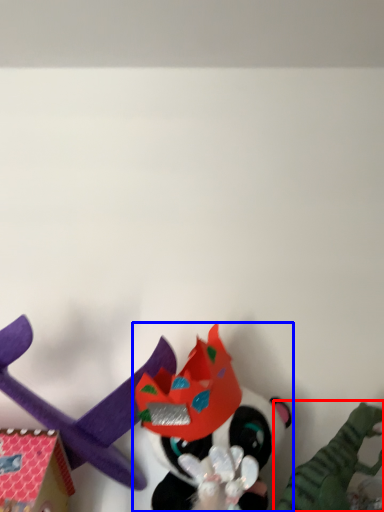
Question: Which point is closer to the camera, toy (highlighted by a red box) or toy (highlighted by a blue box)?

Choices:
 (A) toy
 (B) toy

Answer: (A)